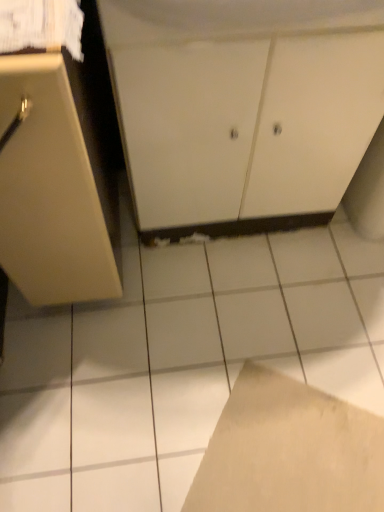
Question: Is brown cardboard at lower center to the right of matte beige cabinet at left, which is counted as the 2th cabinetry, starting from the right, from the viewer's perspective?

Choices:
 (A) no
 (B) yes

Answer: (B)

Question: Does brown cardboard at lower center touch matte beige cabinet at left, marked as the first cabinetry in a left-to-right arrangement?

Choices:
 (A) yes
 (B) no

Answer: (B)

Question: From the image's perspective, is brown cardboard at lower center above matte beige cabinet at left, marked as the first cabinetry in a left-to-right arrangement?

Choices:
 (A) yes
 (B) no

Answer: (B)

Question: Considering the relative positions of brown cardboard at lower center and matte beige cabinet at left, marked as the first cabinetry in a left-to-right arrangement, in the image provided, is brown cardboard at lower center behind matte beige cabinet at left, marked as the first cabinetry in a left-to-right arrangement,?

Choices:
 (A) yes
 (B) no

Answer: (A)

Question: Is brown cardboard at lower center wider than matte beige cabinet at left, which is counted as the 2th cabinetry, starting from the right?

Choices:
 (A) no
 (B) yes

Answer: (A)

Question: From a real-world perspective, is white matte cabinet at center, which is counted as the second cabinetry, starting from the left, positioned above or below brown cardboard at lower center?

Choices:
 (A) below
 (B) above

Answer: (B)

Question: Is white matte cabinet at center, which is counted as the second cabinetry, starting from the left, wider or thinner than brown cardboard at lower center?

Choices:
 (A) thin
 (B) wide

Answer: (A)

Question: From the image's perspective, is white matte cabinet at center, positioned as the 1th cabinetry in right-to-left order, above or below brown cardboard at lower center?

Choices:
 (A) above
 (B) below

Answer: (A)

Question: Do you think white matte cabinet at center, positioned as the 1th cabinetry in right-to-left order, is within brown cardboard at lower center, or outside of it?

Choices:
 (A) outside
 (B) inside

Answer: (A)

Question: Is brown cardboard at lower center taller or shorter than white matte cabinet at center, positioned as the 1th cabinetry in right-to-left order?

Choices:
 (A) short
 (B) tall

Answer: (A)

Question: Is point (370, 441) positioned closer to the camera than point (190, 115)?

Choices:
 (A) farther
 (B) closer

Answer: (A)

Question: In terms of width, does brown cardboard at lower center look wider or thinner when compared to white matte cabinet at center, which is counted as the second cabinetry, starting from the left?

Choices:
 (A) thin
 (B) wide

Answer: (B)

Question: In the image, is brown cardboard at lower center positioned in front of or behind white matte cabinet at center, positioned as the 1th cabinetry in right-to-left order?

Choices:
 (A) front
 (B) behind

Answer: (B)

Question: From a real-world perspective, is matte beige cabinet at left, marked as the first cabinetry in a left-to-right arrangement, above or below white matte cabinet at center, which is counted as the second cabinetry, starting from the left?

Choices:
 (A) below
 (B) above

Answer: (B)

Question: From the image's perspective, is matte beige cabinet at left, marked as the first cabinetry in a left-to-right arrangement, located above or below white matte cabinet at center, positioned as the 1th cabinetry in right-to-left order?

Choices:
 (A) above
 (B) below

Answer: (B)